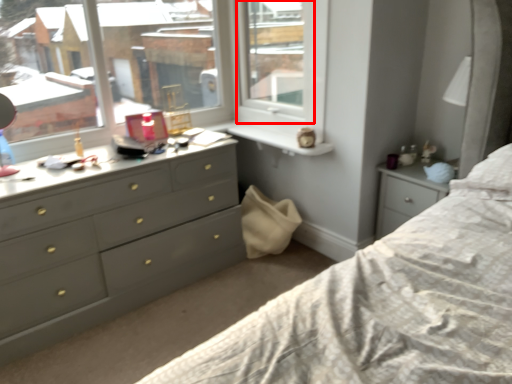
Question: Considering the relative positions of window frame (annotated by the red box) and chest of drawers in the image provided, where is window frame (annotated by the red box) located with respect to the staircase?

Choices:
 (A) right
 (B) left

Answer: (A)